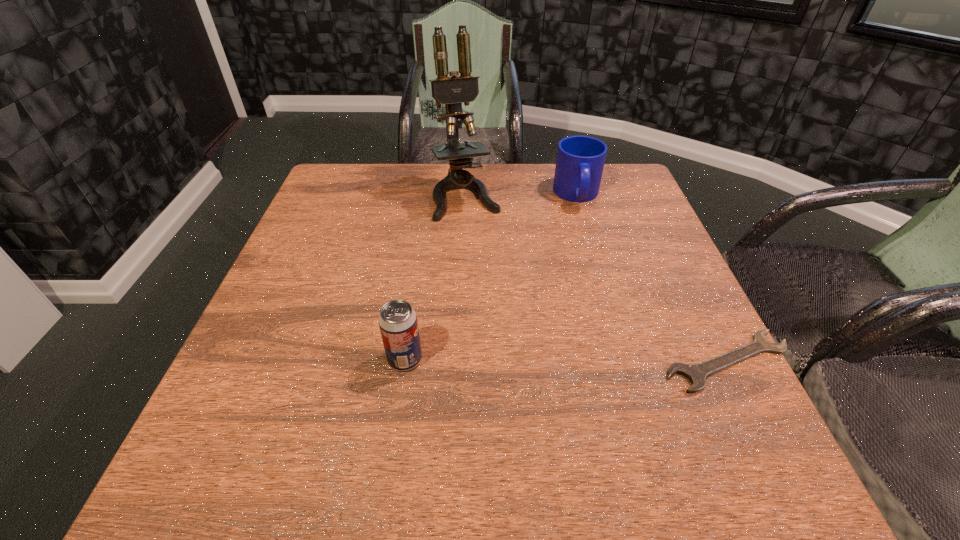
Find the location of `vacant space on the desktop that is between the beer can and the shortest object and is positioned at the eyepieces of the tallest object`. vacant space on the desktop that is between the beer can and the shortest object and is positioned at the eyepieces of the tallest object is located at coordinates (527, 360).

The width and height of the screenshot is (960, 540). In order to click on free space on the desktop that is between the beer can and the shortest object and is positioned on the side with the handle of the third object from left to right in this screenshot , I will do `click(608, 360)`.